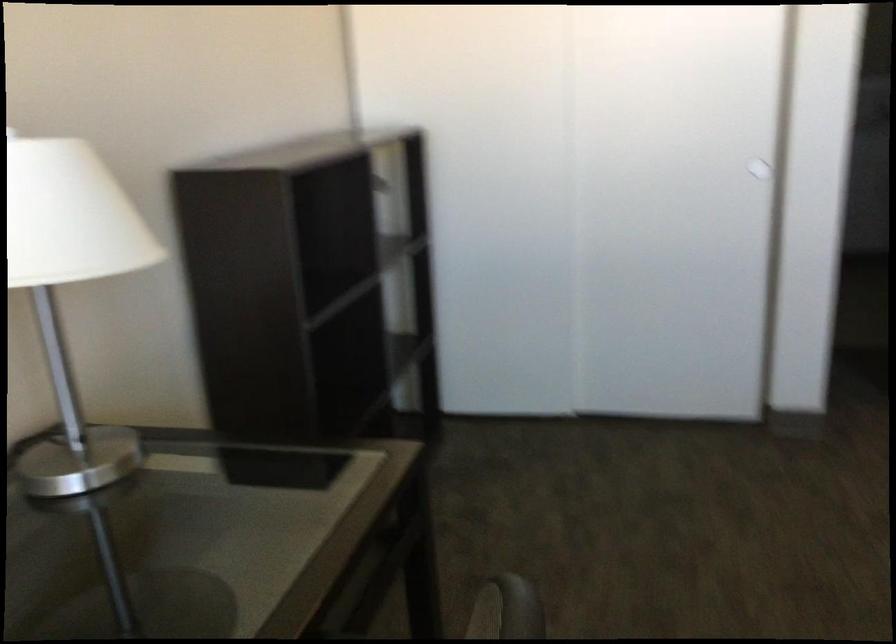
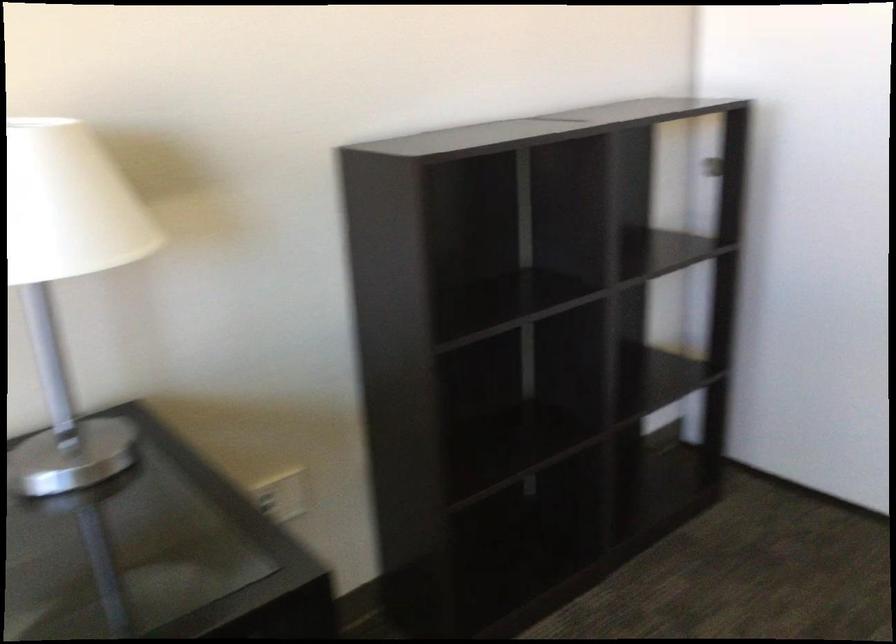
Question: The first image is from the beginning of the video and the second image is from the end. How did the camera likely rotate when shooting the video?

Choices:
 (A) Left
 (B) Right
 (C) Up
 (D) Down

Answer: (A)